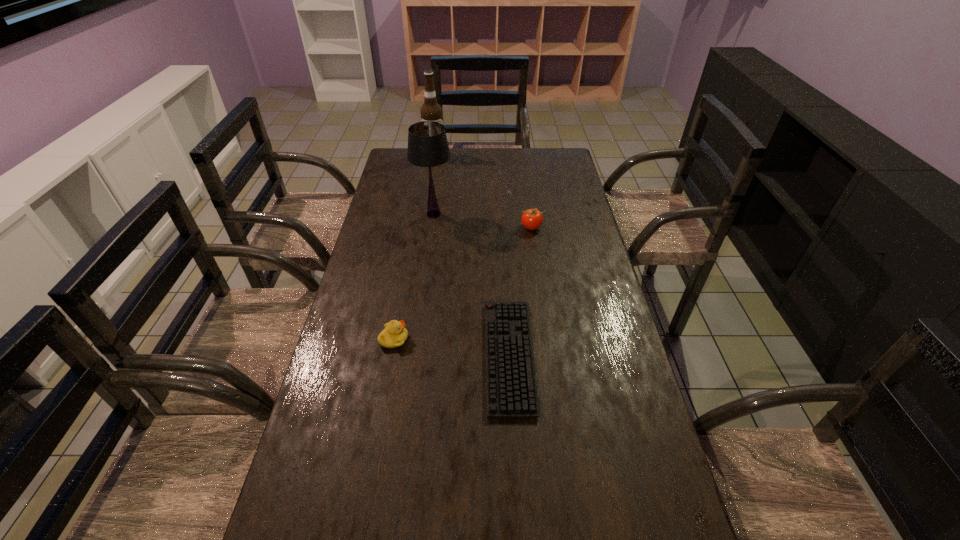
At what (x,y) coordinates should I click in order to perform the action: click on vacant space in between the duckling and the rightmost object. Please return your answer as a coordinate pair (x, y). The width and height of the screenshot is (960, 540). Looking at the image, I should click on (463, 284).

The width and height of the screenshot is (960, 540). I want to click on vacant point located between the rightmost object and the farthest object, so click(x=483, y=192).

Where is `unoccupied position between the farthest object and the fourth object from left to right`? The width and height of the screenshot is (960, 540). unoccupied position between the farthest object and the fourth object from left to right is located at coordinates (471, 256).

This screenshot has width=960, height=540. Identify the location of blank region between the lampshade and the duckling. (414, 276).

Find the location of a particular element. The image size is (960, 540). free space between the lampshade and the tomato is located at coordinates (483, 221).

Where is `free space between the alcohol and the duckling`? free space between the alcohol and the duckling is located at coordinates (415, 247).

Identify the location of free space that is in between the fourth object from left to right and the lampshade. The image size is (960, 540). (471, 285).

What are the coordinates of `empty space that is in between the tomato and the lampshade` in the screenshot? It's located at (483, 221).

Locate an element on the screen. This screenshot has width=960, height=540. free space between the tomato and the second object from right to left is located at coordinates (520, 292).

Locate an element on the screen. This screenshot has height=540, width=960. object that can be found as the fourth closest to the rightmost object is located at coordinates (394, 335).